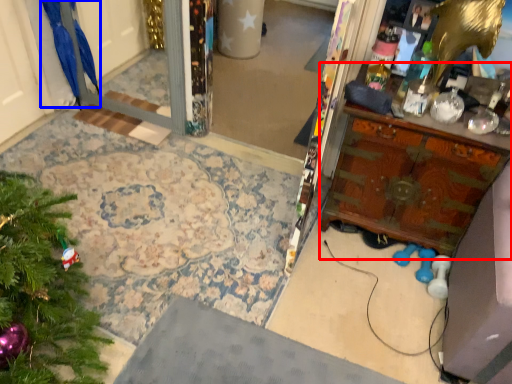
Question: Which of the following is the closest to the observer, vanity (highlighted by a red box) or parrot (highlighted by a blue box)?

Choices:
 (A) vanity
 (B) parrot

Answer: (A)